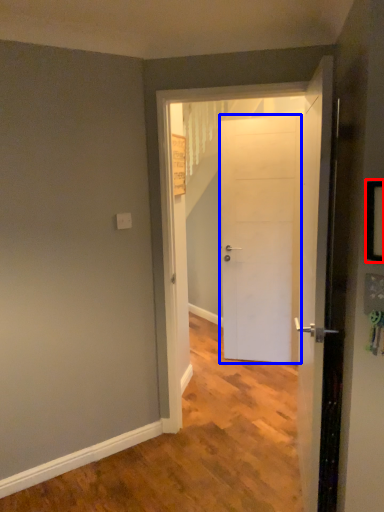
Question: Which object appears farthest to the camera in this image, picture frame (highlighted by a red box) or door (highlighted by a blue box)?

Choices:
 (A) picture frame
 (B) door

Answer: (B)